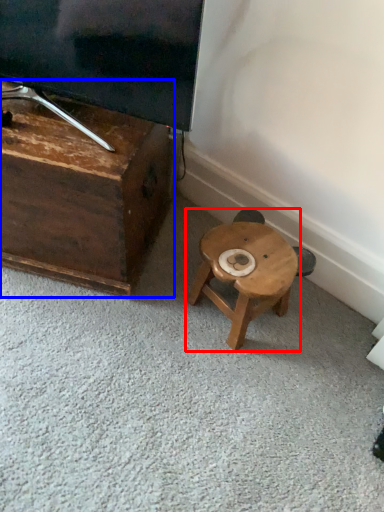
Question: Which point is further to the camera, stool (highlighted by a red box) or furniture (highlighted by a blue box)?

Choices:
 (A) stool
 (B) furniture

Answer: (A)